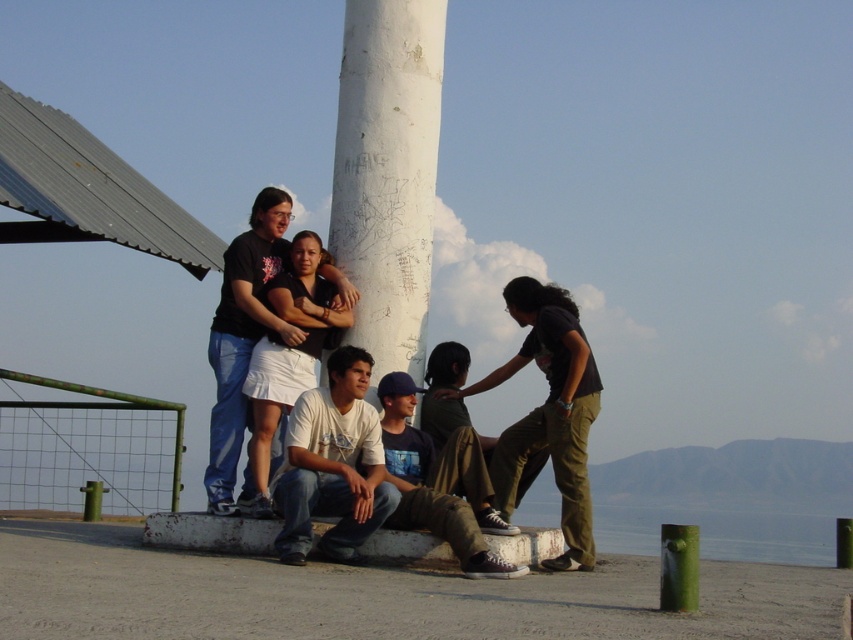
Who is more forward, (x=564, y=376) or (x=367, y=360)?

Point (x=367, y=360) is more forward.

Between point (573, 346) and point (337, 492), which one is positioned in front?

Point (337, 492) is more forward.

You are a GUI agent. You are given a task and a screenshot of the screen. Output one action in this format:
    pyautogui.click(x=<x>, y=<y>)
    Task: Click on the matte black shirt at center
    
    Given the screenshot: What is the action you would take?
    pyautogui.click(x=548, y=412)

Which is above, white matte pillar at center or matte black shirt at upper left?

white matte pillar at center is higher up.

The height and width of the screenshot is (640, 853). Describe the element at coordinates (387, 172) in the screenshot. I see `white matte pillar at center` at that location.

At what (x,y) coordinates should I click in order to perform the action: click on white matte pillar at center. Please return your answer as a coordinate pair (x, y). Image resolution: width=853 pixels, height=640 pixels. Looking at the image, I should click on (387, 172).

Looking at this image, is white matte pillar at center positioned at the back of matte black shirt at center?

Yes, white matte pillar at center is behind matte black shirt at center.

Which is behind, point (393, 320) or point (553, 470)?

The point (393, 320) is more distant.

Identify the location of white matte pillar at center. This screenshot has height=640, width=853. (387, 172).